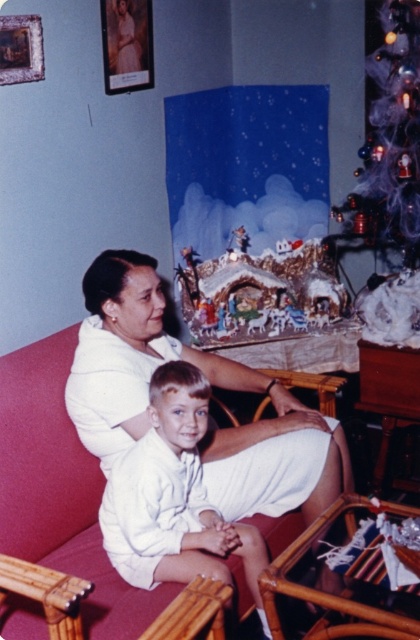
You are planning to hang a picture frame that is 1.5 meters tall on the wall behind the velvet red couch at center. Considering the height of the matte white portrait at upper left, will the new frame fit vertically without overlapping it?

The velvet red couch at center is taller than the matte white portrait at upper left. Since the portrait is at upper left, the new frame of 1.5 meters may overlap if placed directly above the couch. Check the vertical spacing between the couch and the portrait first.

You are planning to place a new rectangular coffee table in front of the velvet red couch at center. Considering the size of the translucent purple tinsel at upper right, can you estimate if the coffee table will fit without blocking the tinsel?

The velvet red couch at center is bigger than the translucent purple tinsel at upper right. Since the couch is larger, there should be enough space to place the coffee table in front of it without blocking the tinsel.

Looking at this image, you are a photographer trying to capture a photo of the velvet red couch at center and the translucent purple tinsel at upper right. Based on their positions, which object is closer to the camera?

The velvet red couch at center is below the translucent purple tinsel at upper right, so the translucent purple tinsel at upper right is closer to the camera.